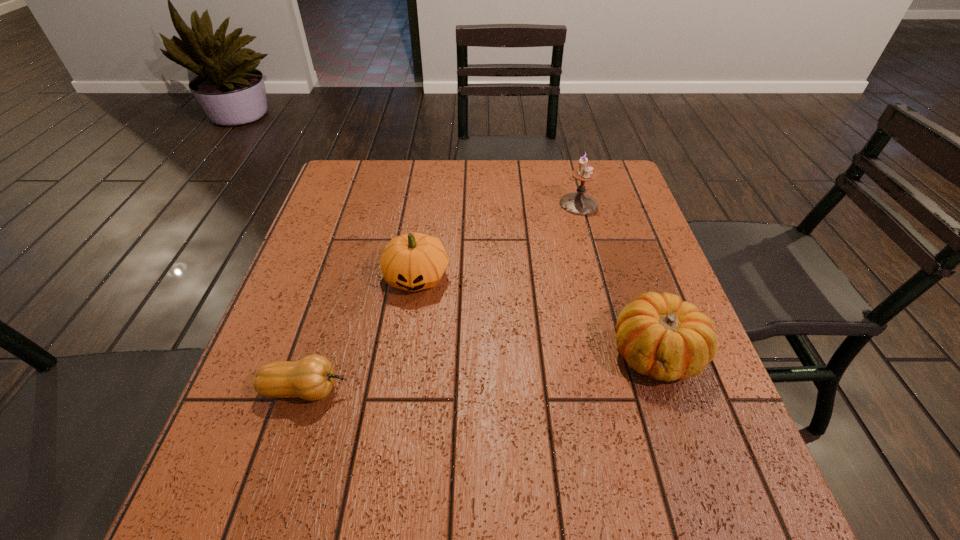
The image size is (960, 540). Identify the location of vacant space at the near left corner. (274, 513).

You are a GUI agent. You are given a task and a screenshot of the screen. Output one action in this format:
    pyautogui.click(x=<x>, y=<y>)
    Task: Click on the free space at the far right corner of the desktop
    The width and height of the screenshot is (960, 540).
    Given the screenshot: What is the action you would take?
    point(594,185)

In order to click on unoccupied position between the rightmost gourd and the tallest object in this screenshot , I will do `click(617, 278)`.

Where is `free space between the shortest object and the tallest object`? The height and width of the screenshot is (540, 960). free space between the shortest object and the tallest object is located at coordinates (442, 297).

In order to click on free space between the farthest gourd and the farthest object in this screenshot , I will do `click(497, 240)`.

I want to click on free space between the rightmost gourd and the leftmost gourd, so (481, 371).

Locate an element on the screen. This screenshot has width=960, height=540. free space between the shortest object and the third object from right to left is located at coordinates (361, 333).

Identify the location of free spot between the rightmost gourd and the third nearest object. (537, 315).

You are a GUI agent. You are given a task and a screenshot of the screen. Output one action in this format:
    pyautogui.click(x=<x>, y=<y>)
    Task: Click on the vacant space in between the third nearest object and the tallest object
    The image size is (960, 540).
    Given the screenshot: What is the action you would take?
    pyautogui.click(x=497, y=240)

The width and height of the screenshot is (960, 540). In order to click on vacant area that lies between the leftmost gourd and the rightmost gourd in this screenshot , I will do `click(481, 371)`.